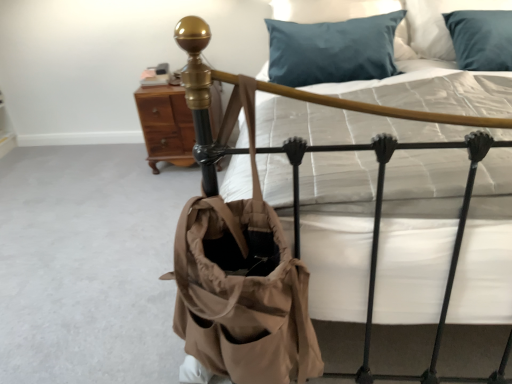
Identify the location of teal satin pillow at upper center. (332, 50).

This screenshot has height=384, width=512. I want to click on white quilted mattress at center, so click(x=402, y=203).

Measure the distance between point (x=274, y=163) and camera.

The depth of point (x=274, y=163) is 3.78 feet.

At what (x,y) coordinates should I click in order to perform the action: click on teal satin pillow at upper center. Please return your answer as a coordinate pair (x, y). The width and height of the screenshot is (512, 384). Looking at the image, I should click on (332, 50).

Is brown wood nightstand at upper left thinner than tan canvas tote at center?

No.

Who is taller, brown wood nightstand at upper left or tan canvas tote at center?

tan canvas tote at center is taller.

Does brown wood nightstand at upper left have a smaller size compared to tan canvas tote at center?

Incorrect, brown wood nightstand at upper left is not smaller in size than tan canvas tote at center.

Is teal satin pillow at upper center next to brown wood nightstand at upper left?

teal satin pillow at upper center and brown wood nightstand at upper left are clearly separated.

From a real-world perspective, which is physically above, teal satin pillow at upper center or brown wood nightstand at upper left?

teal satin pillow at upper center.

Which is in front, point (399, 12) or point (159, 150)?

The point (399, 12) is more forward.

Is teal satin pillow at upper center wider than brown wood nightstand at upper left?

Indeed, teal satin pillow at upper center has a greater width compared to brown wood nightstand at upper left.

Consider the image. Measure the distance between white quilted mattress at center and brown wood nightstand at upper left.

The distance of white quilted mattress at center from brown wood nightstand at upper left is 4.67 feet.

Considering the points (385, 233) and (151, 113), which point is in front, point (385, 233) or point (151, 113)?

The point (385, 233) is closer to the camera.

Based on their positions, is white quilted mattress at center located to the left or right of brown wood nightstand at upper left?

white quilted mattress at center is positioned on brown wood nightstand at upper left's right side.

Is white quilted mattress at center placed right next to brown wood nightstand at upper left?

No, white quilted mattress at center is not in contact with brown wood nightstand at upper left.

Is teal satin pillow at upper center taller or shorter than white quilted mattress at center?

Clearly, teal satin pillow at upper center is shorter compared to white quilted mattress at center.

Is teal satin pillow at upper center positioned before white quilted mattress at center?

No, teal satin pillow at upper center is behind white quilted mattress at center.

From the image's perspective, is teal satin pillow at upper center located above or below white quilted mattress at center?

From the image's perspective, teal satin pillow at upper center appears above white quilted mattress at center.

Which of these two, teal satin pillow at upper center or white quilted mattress at center, is wider?

Wider between the two is white quilted mattress at center.

Consider the image. Does brown wood nightstand at upper left have a smaller size compared to white quilted mattress at center?

Correct, brown wood nightstand at upper left occupies less space than white quilted mattress at center.

Based on the photo, is brown wood nightstand at upper left at the right side of white quilted mattress at center?

No.

Between brown wood nightstand at upper left and white quilted mattress at center, which one has larger width?

With larger width is white quilted mattress at center.

The width and height of the screenshot is (512, 384). What are the coordinates of `bed above the brown wood nightstand at upper left (from a real-world perspective)` in the screenshot? It's located at (402, 203).

From the image's perspective, between tan canvas tote at center and brown wood nightstand at upper left, who is located below?

tan canvas tote at center appears lower in the image.

Which object is positioned more to the left, tan canvas tote at center or brown wood nightstand at upper left?

brown wood nightstand at upper left.

How different are the orientations of tan canvas tote at center and brown wood nightstand at upper left in degrees?

The angular difference between tan canvas tote at center and brown wood nightstand at upper left is 5.5 degrees.

Considering the sizes of objects tan canvas tote at center and brown wood nightstand at upper left in the image provided, who is taller, tan canvas tote at center or brown wood nightstand at upper left?

Standing taller between the two is tan canvas tote at center.

Does white quilted mattress at center appear on the left side of teal satin pillow at upper center?

No, white quilted mattress at center is not to the left of teal satin pillow at upper center.

Find the location of `pillow on the left of white quilted mattress at center`. pillow on the left of white quilted mattress at center is located at coordinates (332, 50).

Does white quilted mattress at center have a smaller size compared to teal satin pillow at upper center?

No.

How different are the orientations of white quilted mattress at center and teal satin pillow at upper center in degrees?

The angle between the facing direction of white quilted mattress at center and the facing direction of teal satin pillow at upper center is 3.18 degrees.

This screenshot has height=384, width=512. In order to click on shoulder bag that is above the brown wood nightstand at upper left (from a real-world perspective) in this screenshot , I will do `click(241, 287)`.

Image resolution: width=512 pixels, height=384 pixels. I want to click on pillow on the right of brown wood nightstand at upper left, so click(332, 50).

Based on their spatial positions, is white quilted mattress at center or brown wood nightstand at upper left closer to tan canvas tote at center?

white quilted mattress at center lies closer to tan canvas tote at center than the other object.

From the image, which object appears to be farther from teal satin pillow at upper center, white quilted mattress at center or brown wood nightstand at upper left?

brown wood nightstand at upper left.

Estimate the real-world distances between objects in this image. Which object is further from tan canvas tote at center, brown wood nightstand at upper left or white quilted mattress at center?

The object further to tan canvas tote at center is brown wood nightstand at upper left.

Estimate the real-world distances between objects in this image. Which object is further from tan canvas tote at center, white quilted mattress at center or teal satin pillow at upper center?

teal satin pillow at upper center lies further to tan canvas tote at center than the other object.

Consider the image. Estimate the real-world distances between objects in this image. Which object is further from white quilted mattress at center, teal satin pillow at upper center or tan canvas tote at center?

Based on the image, teal satin pillow at upper center appears to be further to white quilted mattress at center.

Considering their positions, is brown wood nightstand at upper left positioned closer to white quilted mattress at center than teal satin pillow at upper center?

teal satin pillow at upper center lies closer to white quilted mattress at center than the other object.

Looking at the image, which one is located further to teal satin pillow at upper center, brown wood nightstand at upper left or white quilted mattress at center?

A: Based on the image, brown wood nightstand at upper left appears to be further to teal satin pillow at upper center.

Looking at the image, which one is located closer to teal satin pillow at upper center, brown wood nightstand at upper left or tan canvas tote at center?

brown wood nightstand at upper left.

Identify the location of bed located between tan canvas tote at center and teal satin pillow at upper center in the depth direction. The width and height of the screenshot is (512, 384). (402, 203).

Find the location of a particular element. This screenshot has height=384, width=512. pillow located between white quilted mattress at center and brown wood nightstand at upper left in the depth direction is located at coordinates (332, 50).

Identify the location of pillow positioned between tan canvas tote at center and brown wood nightstand at upper left from near to far. [332, 50].

The image size is (512, 384). I want to click on bed located between tan canvas tote at center and brown wood nightstand at upper left in the depth direction, so click(x=402, y=203).